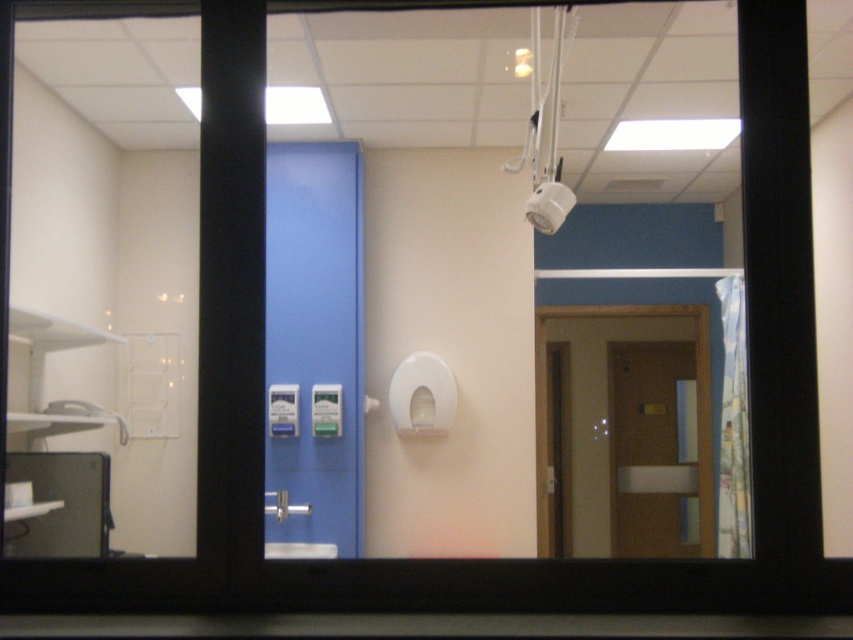
Can you confirm if blue glossy cabinet at center is thinner than matte brown door at right?

Correct, blue glossy cabinet at center's width is less than matte brown door at right's.

Locate an element on the screen. blue glossy cabinet at center is located at coordinates (314, 346).

Is point (345, 525) more distant than point (660, 349)?

No, (345, 525) is in front of (660, 349).

This screenshot has width=853, height=640. I want to click on blue glossy cabinet at center, so click(x=314, y=346).